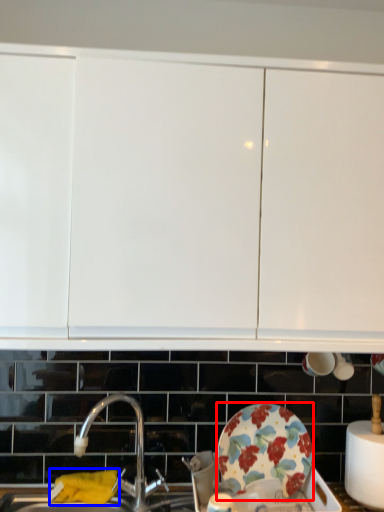
Question: Which object appears closest to the camera in this image, plate (highlighted by a red box) or material (highlighted by a blue box)?

Choices:
 (A) plate
 (B) material

Answer: (A)